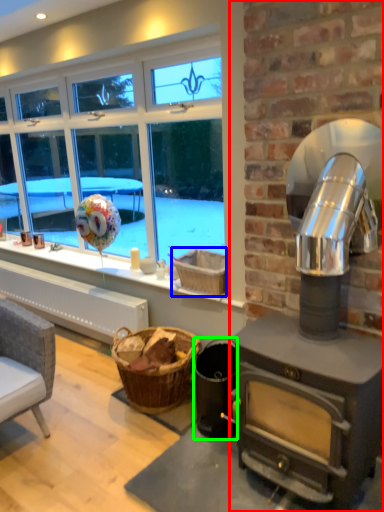
Question: Which object is positioned closest to fireplace (highlighted by a red box)? Select from basket (highlighted by a blue box) and appliance (highlighted by a green box).

Choices:
 (A) basket
 (B) appliance

Answer: (A)